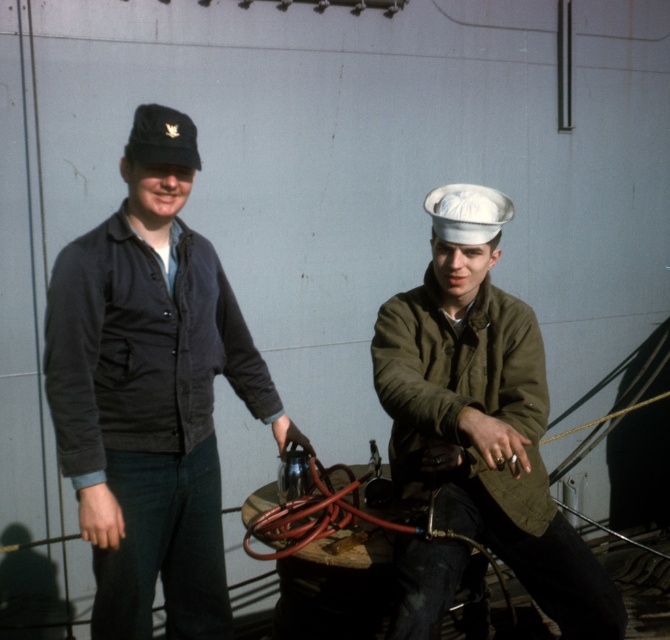
Question: Can you confirm if dark gray corduroy jacket at left is positioned below olive green woolen jacket at right?

Choices:
 (A) no
 (B) yes

Answer: (B)

Question: Which of these objects is positioned farthest from the white matte hat at center?

Choices:
 (A) dark gray corduroy jacket at left
 (B) dark blue corduroy jacket at left
 (C) olive green woolen jacket at right
 (D) black matte cap at upper left

Answer: (A)

Question: Can you confirm if khaki woolen jacket at right is positioned below black matte cap at upper left?

Choices:
 (A) yes
 (B) no

Answer: (A)

Question: Which point appears closest to the camera in this image?

Choices:
 (A) (505, 204)
 (B) (507, 532)
 (C) (168, 224)
 (D) (157, 163)

Answer: (D)

Question: Can you confirm if dark blue corduroy jacket at left is positioned to the left of black matte cap at upper left?

Choices:
 (A) yes
 (B) no

Answer: (B)

Question: Based on their relative distances, which object is nearer to the olive green woolen jacket at right?

Choices:
 (A) white matte hat at center
 (B) khaki woolen jacket at right

Answer: (B)